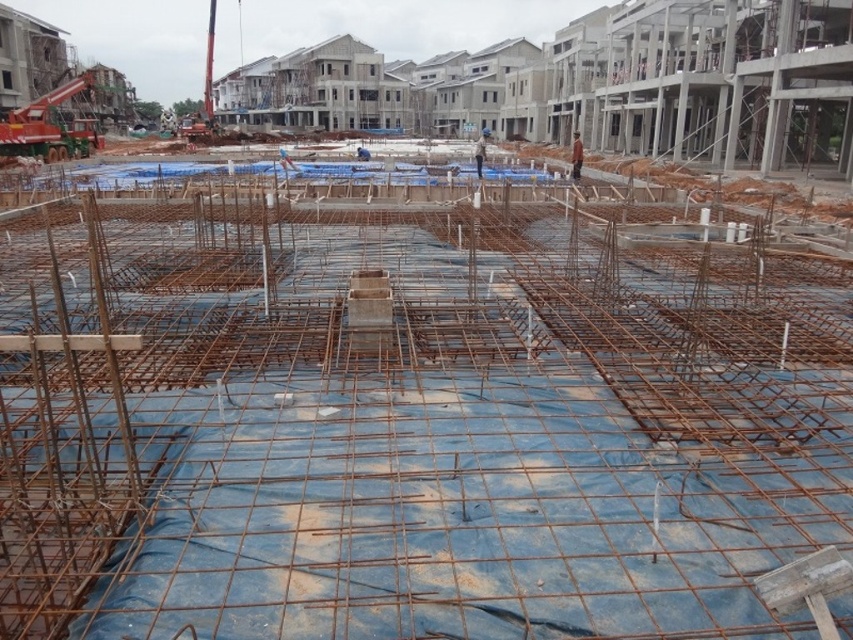
You are a construction inspector standing at the edge of the construction site. You need to locate the brown leather jacket at center for a safety check. According to the coordinates provided, where exactly should you look to find it?

The brown leather jacket at center is located at point (576, 156), so you should look at that coordinate to find it.

You are a safety inspector at the construction site. You notice two items at the center of the site, the brown leather jacket at center and the blue hard hat at center. Which item is shorter in height?

The brown leather jacket at center is not as tall as the blue hard hat at center, so the brown leather jacket at center is shorter in height.